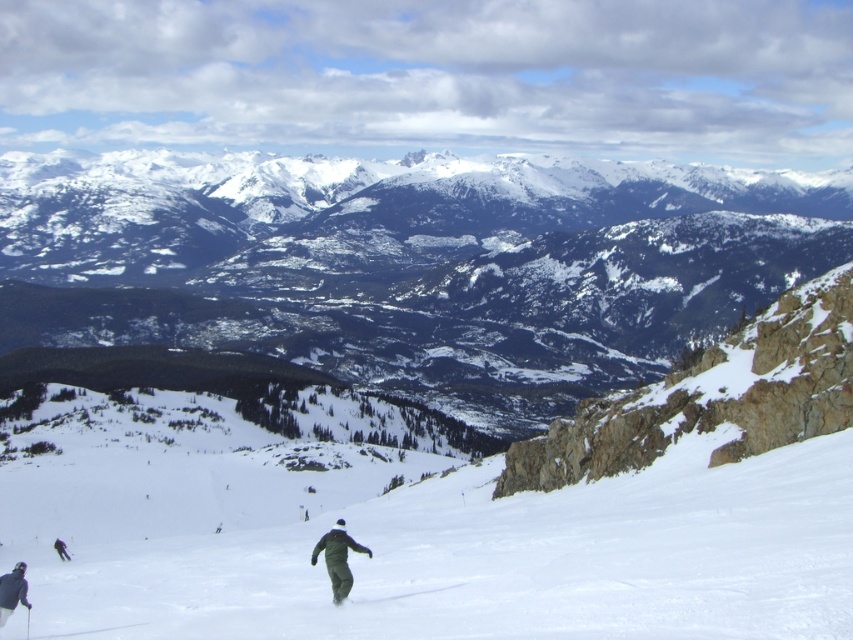
Question: In this image, where is white snow ski slope at center located relative to green fabric jacket at lower left?

Choices:
 (A) below
 (B) above

Answer: (B)

Question: Which point is farther to the camera?

Choices:
 (A) dark gray snowsuit at lower left
 (B) green matte ski at center

Answer: (B)

Question: Is white snow ski slope at center smaller than dark gray snowsuit at lower left?

Choices:
 (A) no
 (B) yes

Answer: (A)

Question: Which object is the farthest from the green matte ski at center?

Choices:
 (A) green fabric jacket at lower left
 (B) white snow ski slope at center
 (C) dark gray snowsuit at lower left
 (D) dark green fabric pants at center

Answer: (A)

Question: Among these objects, which one is nearest to the camera?

Choices:
 (A) dark green fabric pants at center
 (B) white snow ski slope at center
 (C) green matte ski at center
 (D) green fabric jacket at lower left

Answer: (B)

Question: Is dark gray snowsuit at lower left closer to camera compared to green fabric jacket at lower left?

Choices:
 (A) no
 (B) yes

Answer: (B)